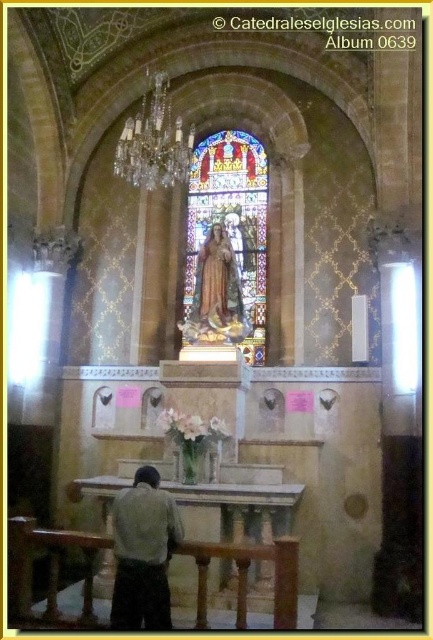
You are standing in the church and want to take a photo of the stained glass window at center. Considering the distance, would you need a zoom lens to capture the entire window in your shot?

The stained glass window at center is 184.48 feet away from the viewer. A zoom lens would be necessary to capture the entire window at that distance.

You are standing in the church and notice a light brown leather jacket at lower left. Where exactly is it positioned in relation to the altar area?

The light brown leather jacket at lower left is located at point (142, 552), which places it near the lower left corner of the altar area, close to the entrance or side aisle.

Based on the photo, you are standing in the church and want to take a photo of the stained glass window at center. Where should you position yourself to capture it in the best possible frame?

The stained glass window at center is located at point (226, 244), so you should position yourself directly in front of it to capture it in the best possible frame.